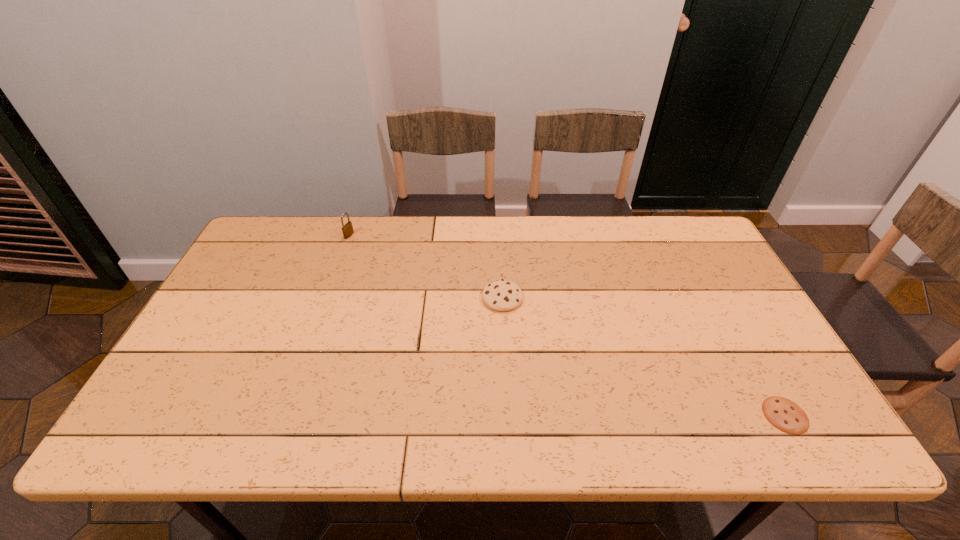
Choose which object is the second nearest neighbor to the padlock. Please provide its 2D coordinates. Your answer should be formatted as a tuple, i.e. [(x, y)], where the tuple contains the x and y coordinates of a point satisfying the conditions above.

[(784, 414)]

Locate an element on the screen. free space that satisfies the following two spatial constraints: 1. on the front side of the shortest object; 2. on the right side of the tallest object is located at coordinates (285, 415).

The image size is (960, 540). Find the location of `vacant space that satisfies the following two spatial constraints: 1. on the front side of the leftmost object; 2. on the right side of the taller cookie`. vacant space that satisfies the following two spatial constraints: 1. on the front side of the leftmost object; 2. on the right side of the taller cookie is located at coordinates (327, 298).

In order to click on free space that satisfies the following two spatial constraints: 1. on the front side of the farthest object; 2. on the right side of the shortest object in this screenshot , I will do `click(285, 415)`.